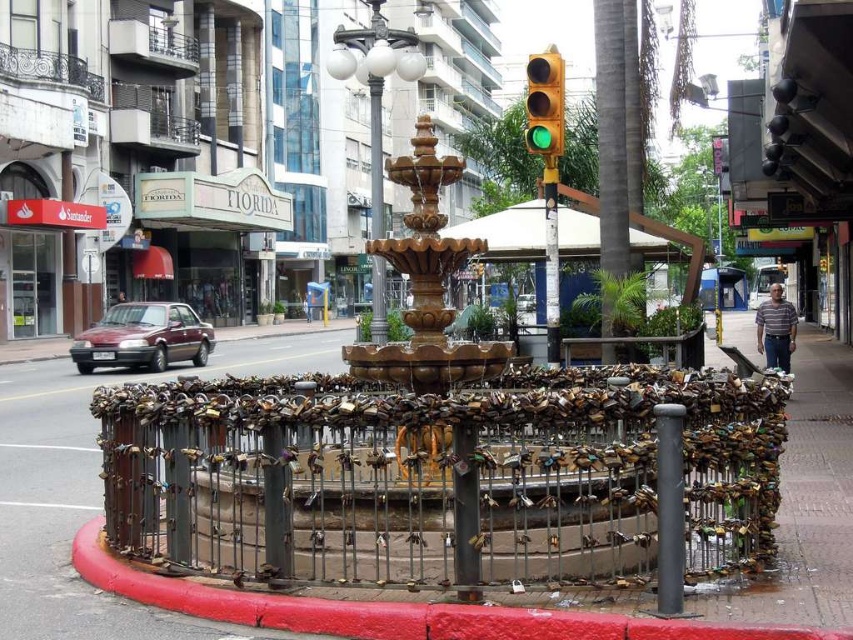
Describe the element at coordinates (393, 611) in the screenshot. I see `smooth painted curb at lower left` at that location.

Where is `smooth painted curb at lower left`? smooth painted curb at lower left is located at coordinates (393, 611).

Who is taller, golden polished fountain at center or bronze polished pole at center?

With more height is bronze polished pole at center.

Between golden polished fountain at center and bronze polished pole at center, which one has less height?

With less height is golden polished fountain at center.

Is point (415, 369) positioned in front of point (370, 163)?

Yes, point (415, 369) is in front of point (370, 163).

Where is `golden polished fountain at center`? This screenshot has width=853, height=640. golden polished fountain at center is located at coordinates click(x=426, y=284).

Between gold metallic fountain at center and golden polished fountain at center, which one has less height?

golden polished fountain at center is shorter.

Does gold metallic fountain at center have a larger size compared to golden polished fountain at center?

No.

Does point (268, 385) lie behind point (395, 371)?

Yes, it is.

Locate an element on the screen. The height and width of the screenshot is (640, 853). gold metallic fountain at center is located at coordinates (436, 454).